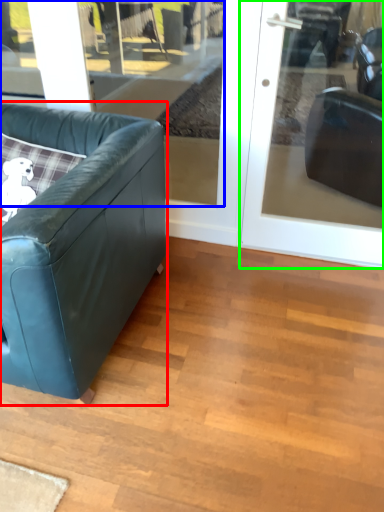
Question: Considering the real-world distances, which object is closest to studio couch (highlighted by a red box)? window (highlighted by a blue box) or door (highlighted by a green box).

Choices:
 (A) window
 (B) door

Answer: (B)